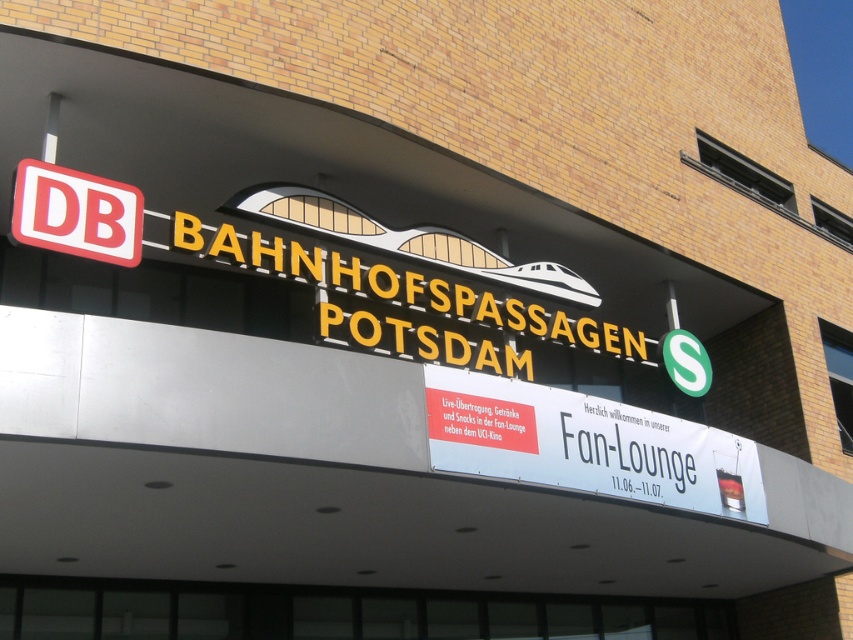
Between white paper banner at center and red plastic db sign at upper left, which one appears on the left side from the viewer's perspective?

red plastic db sign at upper left

Between white paper banner at center and red plastic db sign at upper left, which one has more height?

With more height is white paper banner at center.

Locate an element on the screen. white paper banner at center is located at coordinates (587, 444).